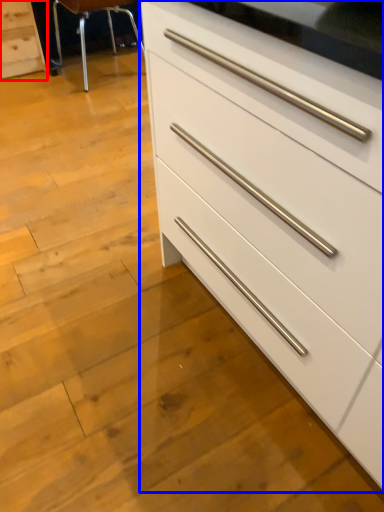
Question: Which object is closer to the camera taking this photo, chest of drawers (highlighted by a red box) or chest of drawers (highlighted by a blue box)?

Choices:
 (A) chest of drawers
 (B) chest of drawers

Answer: (B)